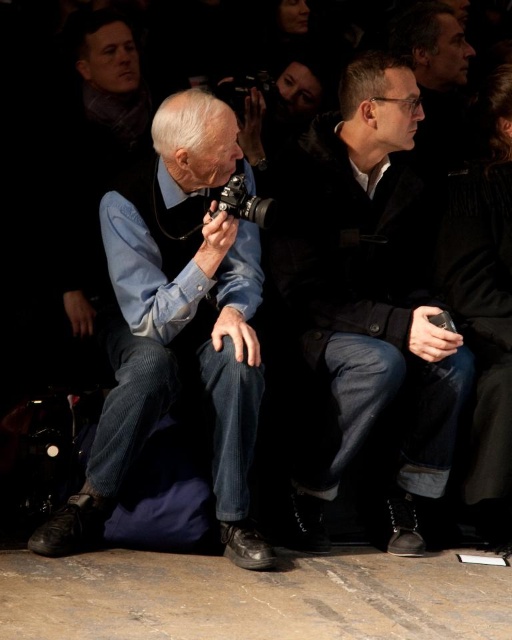
Question: Is the position of denim jeans at center more distant than that of silver metallic camera at center?

Choices:
 (A) no
 (B) yes

Answer: (B)

Question: Which object appears farthest from the camera in this image?

Choices:
 (A) matte black camera at center
 (B) dark blue corduroy pants at center
 (C) denim jeans at center

Answer: (C)

Question: Among these points, which one is nearest to the camera?

Choices:
 (A) (258, 216)
 (B) (415, 124)
 (C) (135, 252)
 (D) (497, 444)

Answer: (A)

Question: Can you confirm if dark blue corduroy pants at center is thinner than denim jeans at center?

Choices:
 (A) no
 (B) yes

Answer: (A)

Question: Is the position of matte black camera at center less distant than that of denim jeans at center?

Choices:
 (A) no
 (B) yes

Answer: (B)

Question: Which of the following is the farthest from the observer?

Choices:
 (A) denim jeans at center
 (B) dark blue corduroy pants at center

Answer: (A)